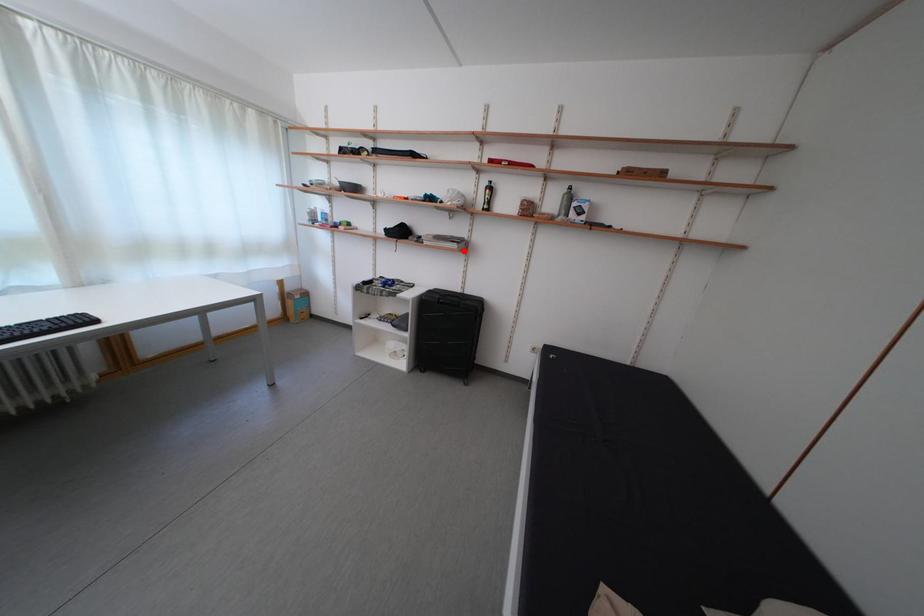
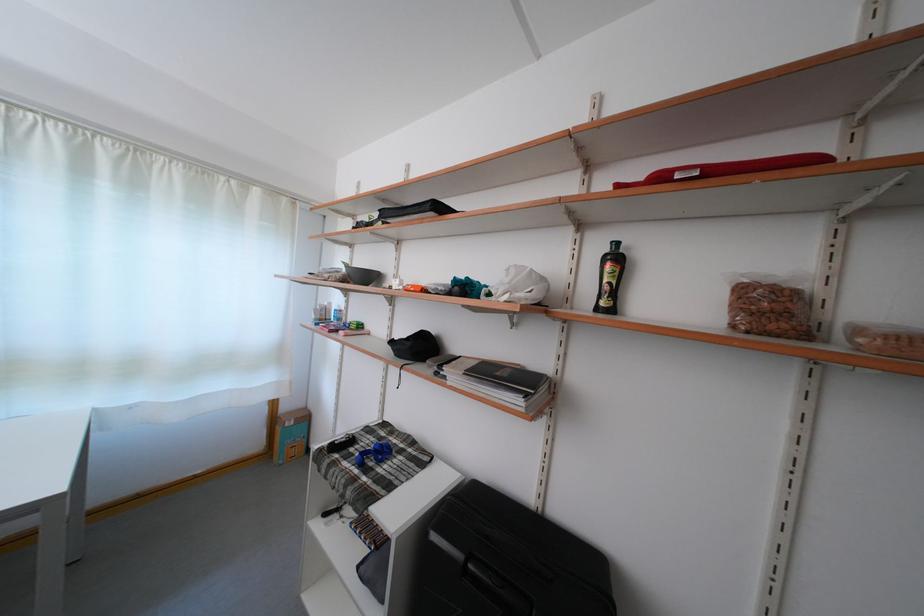
In the second image, find the point that corresponds to the highlighted location in the first image.

(527, 408)